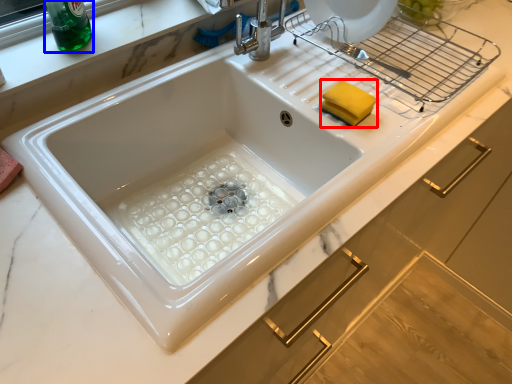
Question: Which of the following is the closest to the observer, food (highlighted by a red box) or beverage (highlighted by a blue box)?

Choices:
 (A) food
 (B) beverage

Answer: (B)